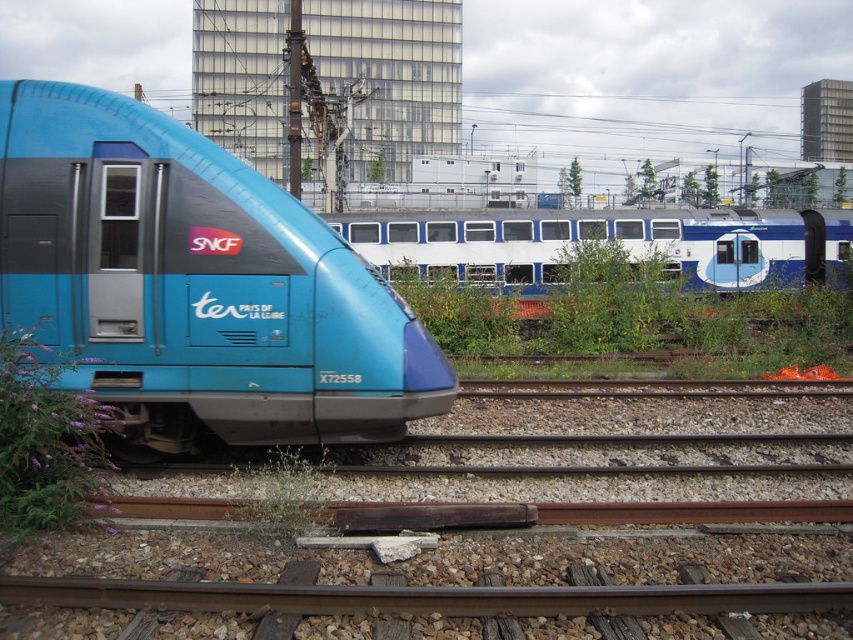
You are a photographer planning to take a photo of the white glossy passenger train at center and the purple soft plant at lower left. Considering their sizes, which object should you focus on first to ensure it fits entirely within the frame?

The white glossy passenger train at center is much taller than the purple soft plant at lower left, so you should focus on ensuring the train fits first since it is larger.

You are a passenger waiting at the train station. You see the matte blue train at left and the purple soft plant at lower left. Which object is closer to you?

The purple soft plant at lower left is closer to you because it is positioned under the matte blue train at left.